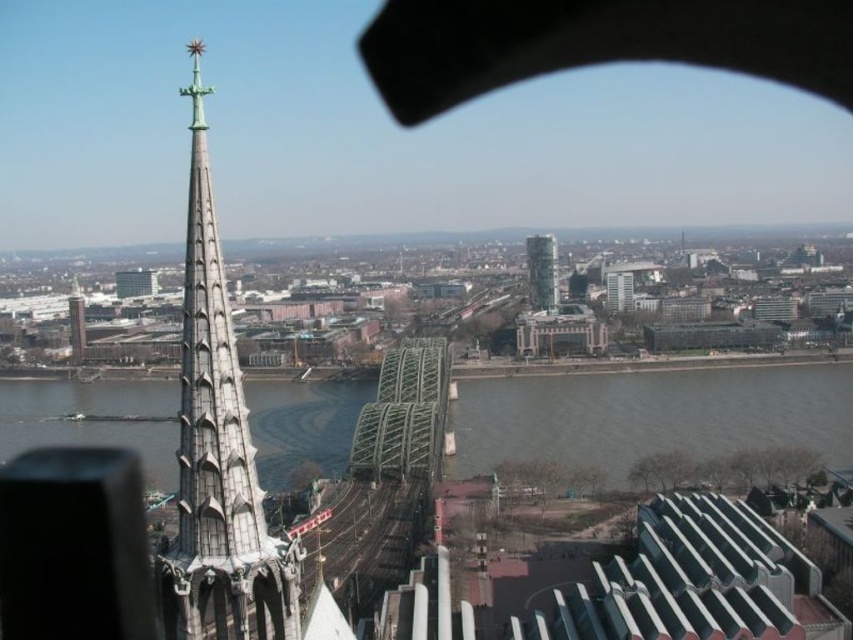
You are a tourist standing at the base of the matte gray tower at left and want to take a photo of the gray metallic water at center. Which direction should you face to capture both the tower and the water in the same frame?

You should face towards the direction where the gray metallic water at center is located, as it is positioned below the matte gray tower at left, allowing both to be included in the frame when looking downward or adjusting the camera angle appropriately.